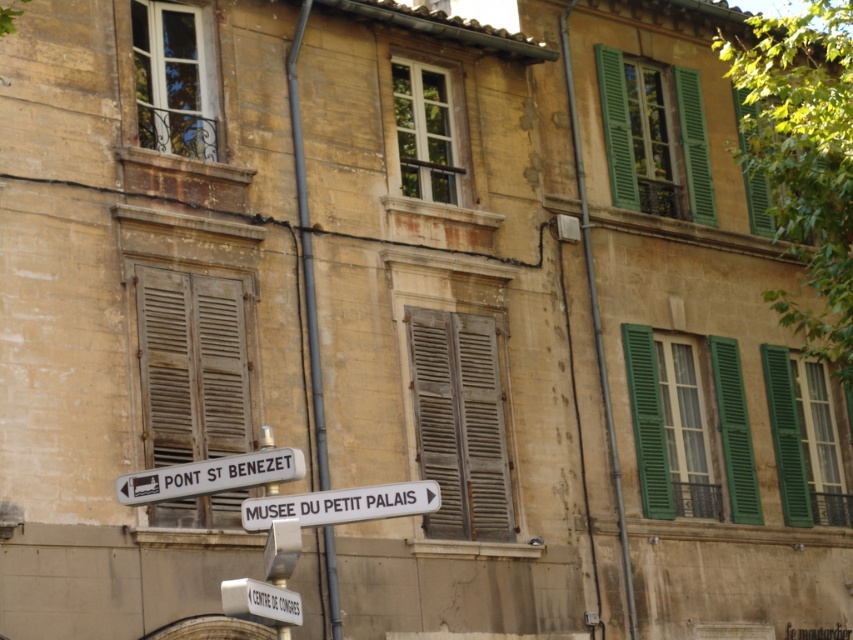
Based on the photo, does wooden shutters at left appear under white plastic sign at lower left?

Yes.

Is wooden shutters at left bigger than white plastic sign at lower left?

No, wooden shutters at left is not bigger than white plastic sign at lower left.

Is point (154, 362) farther from viewer compared to point (154, 484)?

That is True.

Where is `wooden shutters at left`? The height and width of the screenshot is (640, 853). wooden shutters at left is located at coordinates (190, 365).

Does point (694, 448) come behind point (207, 490)?

Yes, point (694, 448) is behind point (207, 490).

Does green matte shutters at center right appear on the right side of white plastic sign at lower left?

Correct, you'll find green matte shutters at center right to the right of white plastic sign at lower left.

I want to click on green matte shutters at center right, so click(x=663, y=420).

Who is higher up, green matte shutters at center right or white plastic sign at lower center?

green matte shutters at center right

Between green matte shutters at center right and white plastic sign at lower center, which one appears on the left side from the viewer's perspective?

white plastic sign at lower center

Between point (738, 424) and point (296, 620), which one is positioned in front?

Point (296, 620) is in front.

Identify the location of green matte shutters at center right. (663, 420).